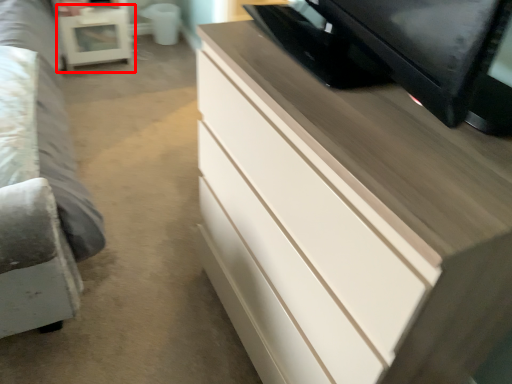
Question: Where is table (annotated by the red box) located in relation to chest of drawers in the image?

Choices:
 (A) right
 (B) left

Answer: (B)